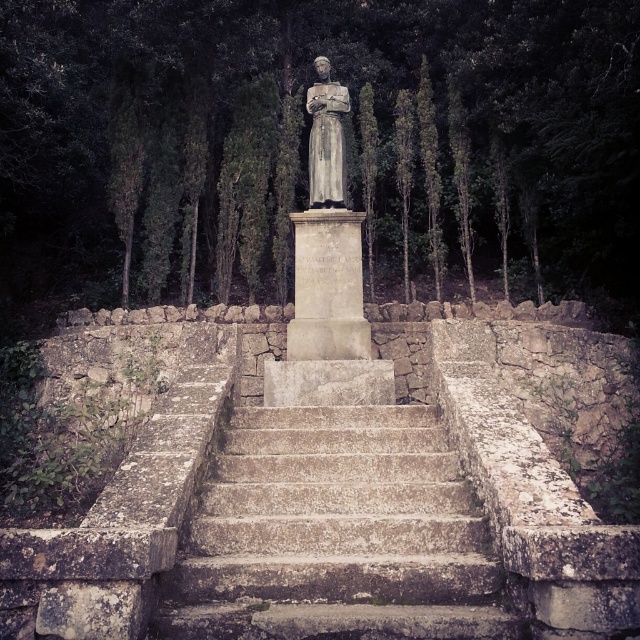
Question: In this image, where is green leafy trees at center located relative to gray stone statue at center?

Choices:
 (A) below
 (B) above

Answer: (B)

Question: Considering the real-world distances, which object is closest to the green leafy trees at center?

Choices:
 (A) gray stone statue at center
 (B) rusty stone stairs at center

Answer: (A)

Question: Which is nearer to the green leafy trees at center?

Choices:
 (A) rusty stone stairs at center
 (B) gray stone statue at center

Answer: (B)

Question: Which of the following is the closest to the observer?

Choices:
 (A) green leafy trees at center
 (B) gray stone statue at center
 (C) rusty stone stairs at center

Answer: (C)

Question: Does green leafy trees at center appear on the right side of gray stone statue at center?

Choices:
 (A) yes
 (B) no

Answer: (B)

Question: Can you confirm if green leafy trees at center is bigger than rusty stone stairs at center?

Choices:
 (A) no
 (B) yes

Answer: (B)